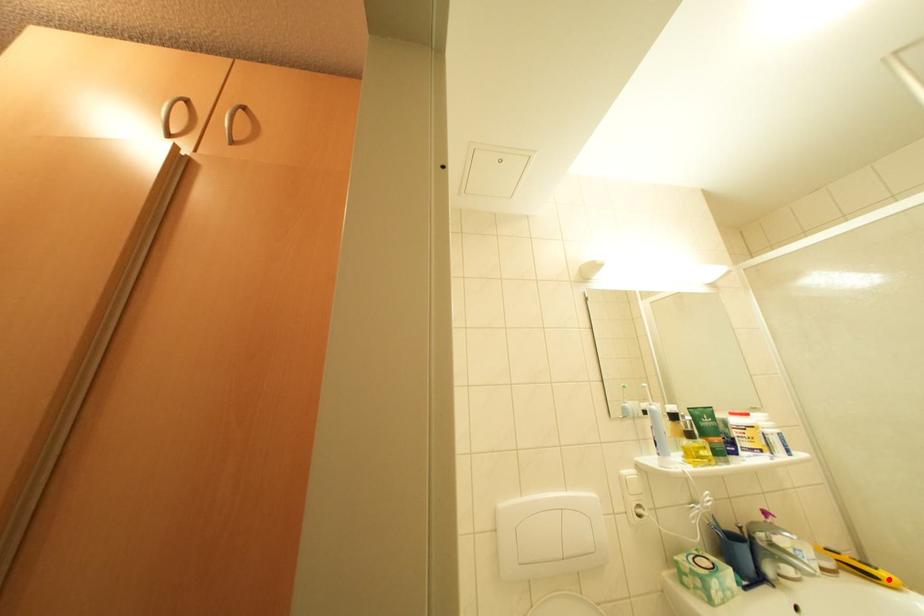
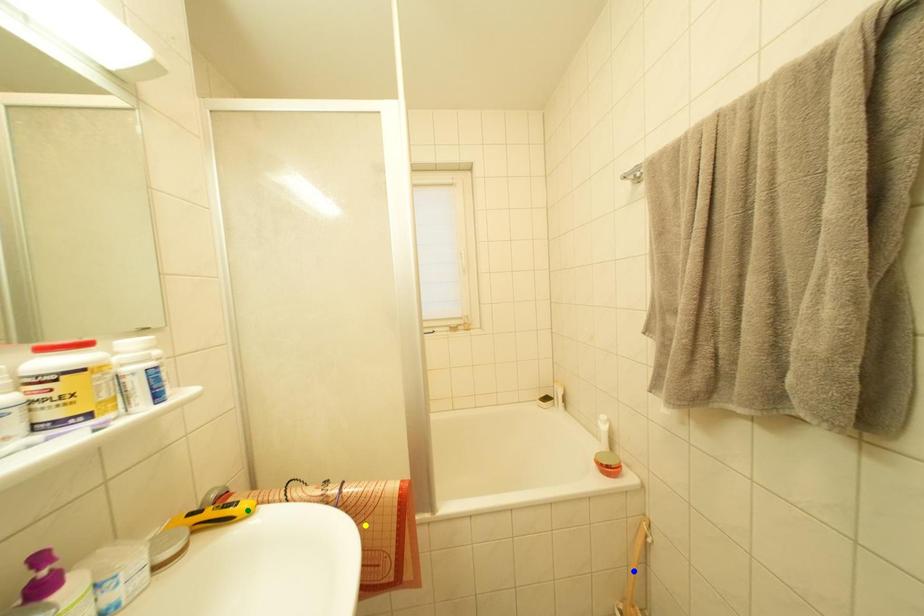
Question: I am providing you with two images of the same scene from different viewpoints. A red point is marked on the first image. You are given multiple points on the second image. Can you choose the point in image 2 that corresponds to the point in image 1?

Choices:
 (A) green point
 (B) blue point
 (C) yellow point

Answer: (A)